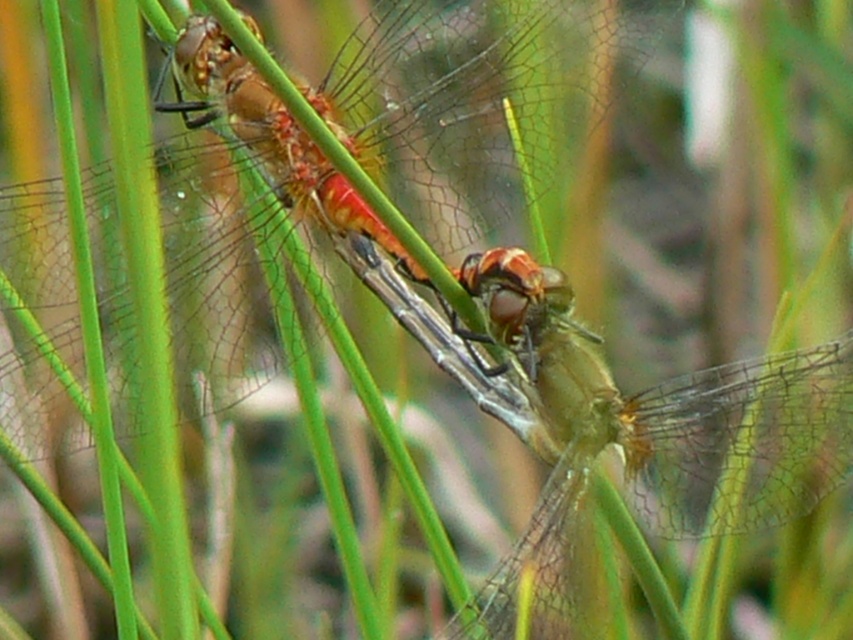
Does point (212, 131) come farther from viewer compared to point (535, 584)?

Yes, point (212, 131) is farther from viewer.

Does translucent orange dragonfly at center appear under translucent yellow-green dragonfly at center?

No, translucent orange dragonfly at center is not below translucent yellow-green dragonfly at center.

Which is behind, point (44, 385) or point (737, 444)?

The point (737, 444) is behind.

You are a GUI agent. You are given a task and a screenshot of the screen. Output one action in this format:
    pyautogui.click(x=<x>, y=<y>)
    Task: Click on the translucent orange dragonfly at center
    
    Given the screenshot: What is the action you would take?
    pyautogui.click(x=457, y=122)